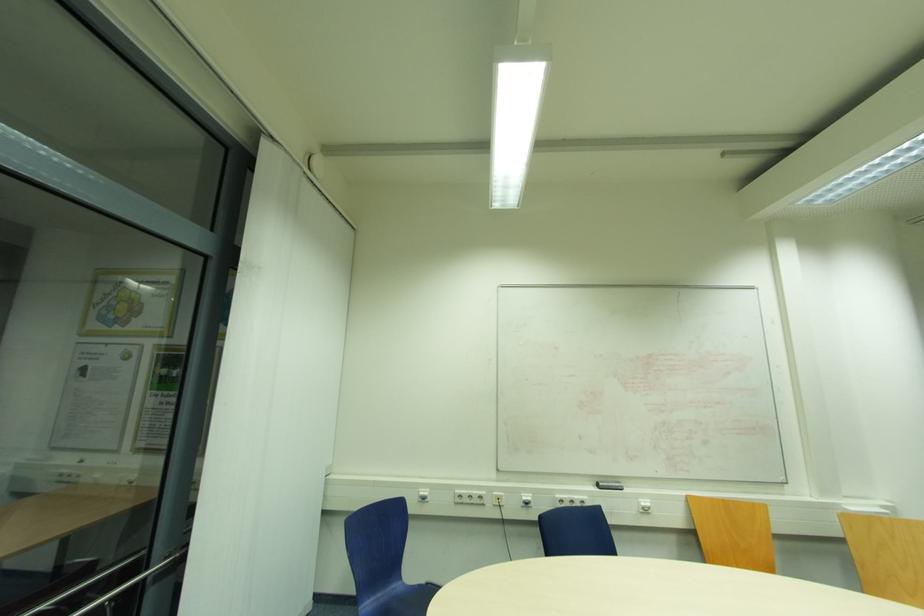
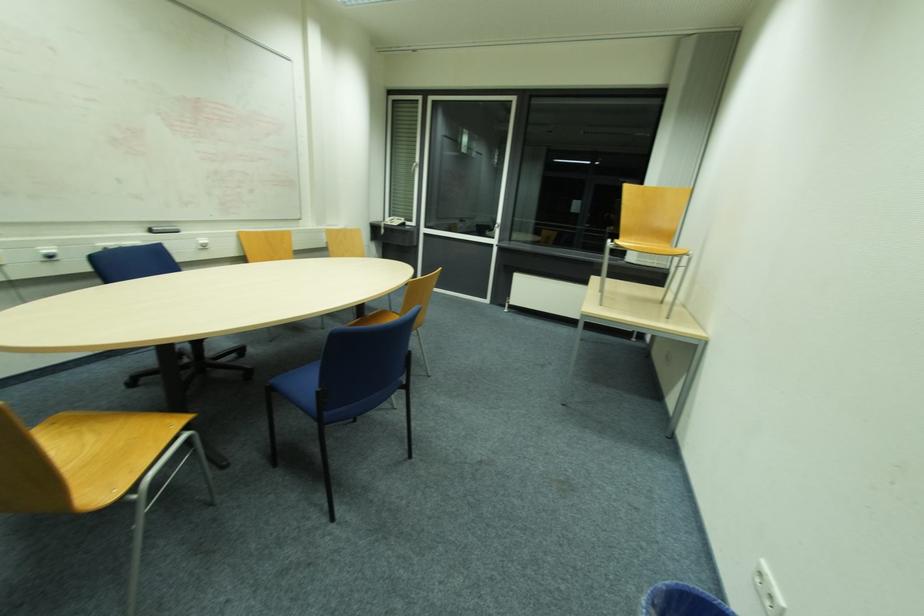
The first image is from the beginning of the video and the second image is from the end. How did the camera likely rotate when shooting the video?

The camera rotated toward right-down.